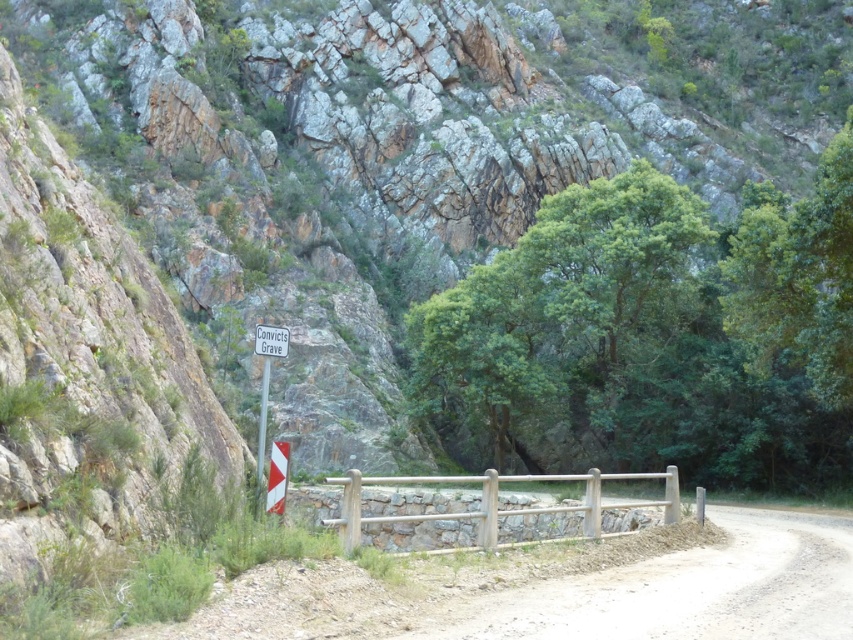
Question: Considering the relative positions of wooden fence at center and white plastic sign at center in the image provided, where is wooden fence at center located with respect to white plastic sign at center?

Choices:
 (A) below
 (B) above

Answer: (A)

Question: Which of the following is the closest to the observer?

Choices:
 (A) (287, 337)
 (B) (540, 528)

Answer: (A)

Question: Estimate the real-world distances between objects in this image. Which object is closer to the dusty gravel road at center?

Choices:
 (A) white plastic sign at center
 (B) white plastic sign at lower left
 (C) white plastic signpost at center

Answer: (A)

Question: Is dusty gravel road at center wider than white plastic sign at lower left?

Choices:
 (A) no
 (B) yes

Answer: (B)

Question: Which of the following is the farthest from the observer?

Choices:
 (A) (601, 588)
 (B) (263, 458)

Answer: (B)

Question: Does dusty gravel road at center appear over white plastic sign at lower left?

Choices:
 (A) yes
 (B) no

Answer: (B)